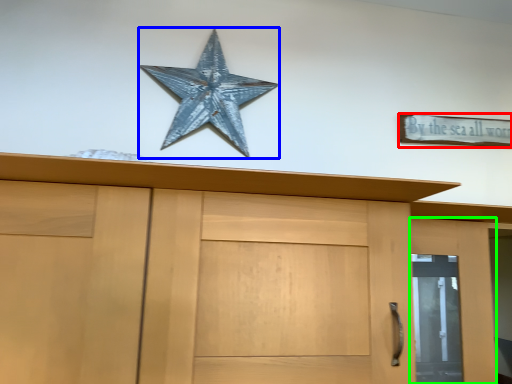
Question: Considering the real-world distances, which object is closest to magnet (highlighted by a red box)? starfish (highlighted by a blue box) or door (highlighted by a green box).

Choices:
 (A) starfish
 (B) door

Answer: (B)